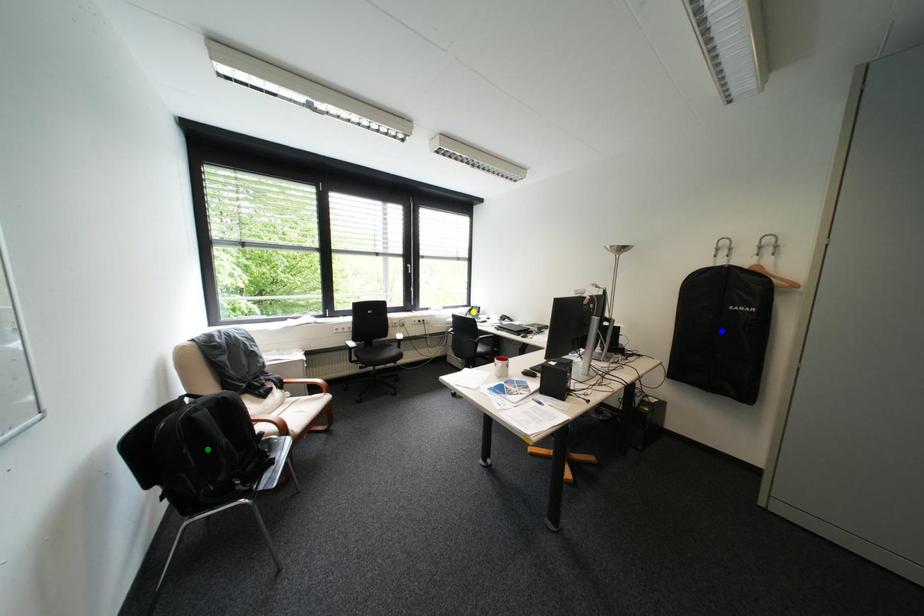
Looking at this image, order these from nearest to farthest:
blue point
green point
yellow point

green point, blue point, yellow point